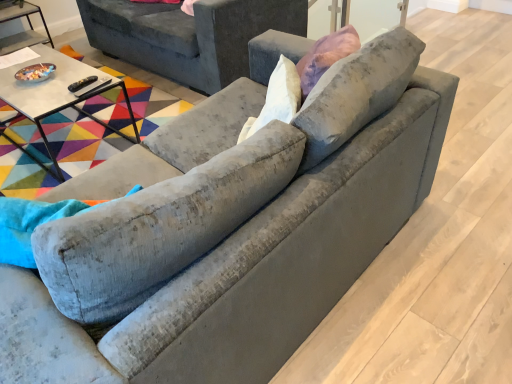
Question: From a real-world perspective, is velvet gray swivel chair at left above or below matte glass bowl at left, which is counted as the second table, starting from the right?

Choices:
 (A) above
 (B) below

Answer: (A)

Question: Considering the positions of velvet gray swivel chair at left and matte glass bowl at left, which is counted as the 1th table, starting from the left, in the image, is velvet gray swivel chair at left taller or shorter than matte glass bowl at left, which is counted as the 1th table, starting from the left,?

Choices:
 (A) short
 (B) tall

Answer: (B)

Question: Estimate the real-world distances between objects in this image. Which object is farther from the matte glass bowl at left, which is counted as the second table, starting from the right?

Choices:
 (A) velvet gray couch at upper center
 (B) velvet gray swivel chair at left
 (C) white glossy table at upper left, which is counted as the first table, starting from the front

Answer: (B)

Question: Which of these objects is positioned farthest from the matte glass bowl at left, positioned as the 1th table in top-to-bottom order?

Choices:
 (A) velvet gray swivel chair at left
 (B) velvet gray couch at upper center
 (C) white glossy table at upper left, the 2th table when ordered from back to front

Answer: (A)